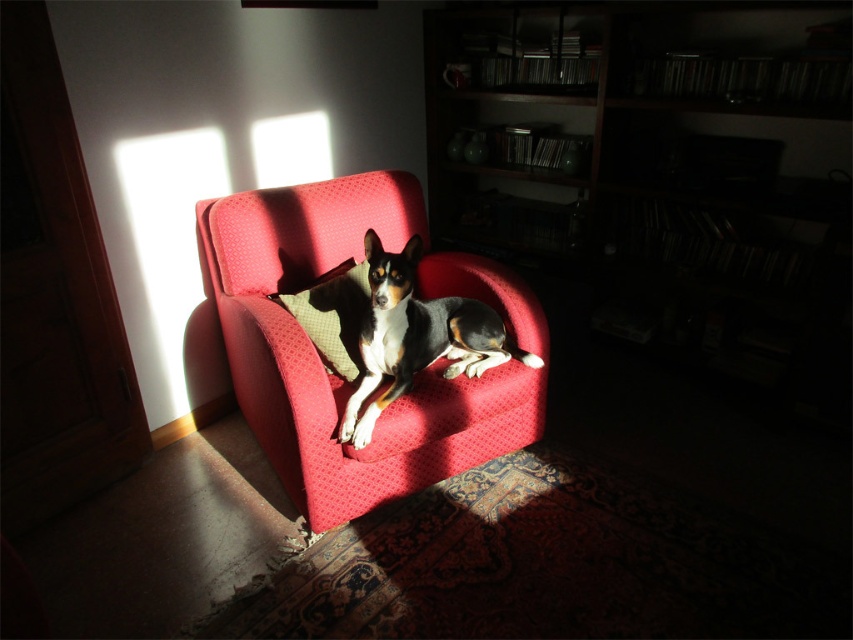
Does black and white fur dog at center have a lesser height compared to green textured pillow at center?

No, black and white fur dog at center is not shorter than green textured pillow at center.

Identify the location of black and white fur dog at center. This screenshot has height=640, width=853. (416, 336).

Locate an element on the screen. This screenshot has width=853, height=640. black and white fur dog at center is located at coordinates (416, 336).

Is point (375, 394) more distant than point (351, 376)?

No, (375, 394) is in front of (351, 376).

The width and height of the screenshot is (853, 640). What do you see at coordinates (323, 365) in the screenshot? I see `velvet red armchair at center` at bounding box center [323, 365].

This screenshot has width=853, height=640. What are the coordinates of `velvet red armchair at center` in the screenshot? It's located at (323, 365).

Which is in front, point (250, 330) or point (399, 365)?

Point (399, 365)

Which is behind, point (316, 492) or point (415, 337)?

Positioned behind is point (415, 337).

Identify the location of velvet red armchair at center. The image size is (853, 640). (323, 365).

What are the coordinates of `velvet red armchair at center` in the screenshot? It's located at (323, 365).